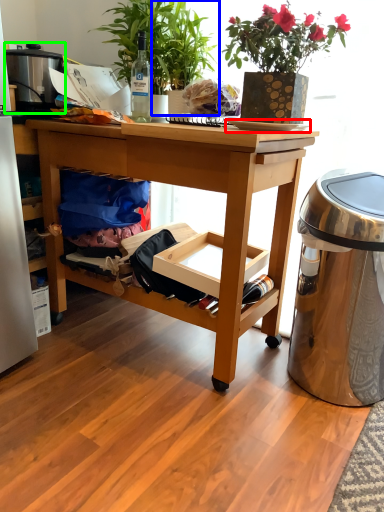
Question: Considering the real-world distances, which object is farthest from plate (highlighted by a red box)? houseplant (highlighted by a blue box) or appliance (highlighted by a green box)?

Choices:
 (A) houseplant
 (B) appliance

Answer: (B)